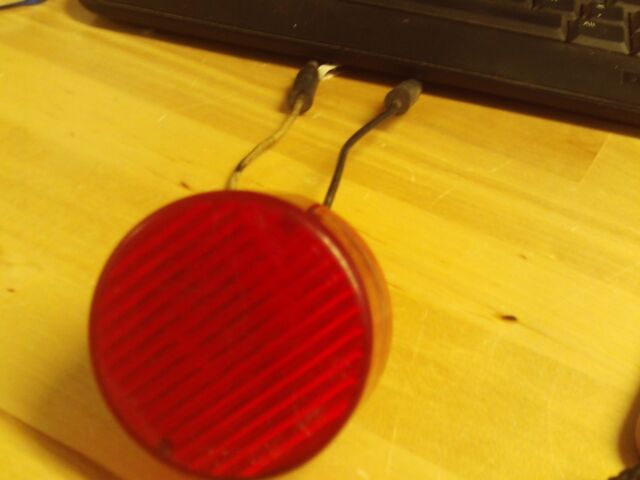
I want to click on wire holders, so click(308, 98), click(401, 100).